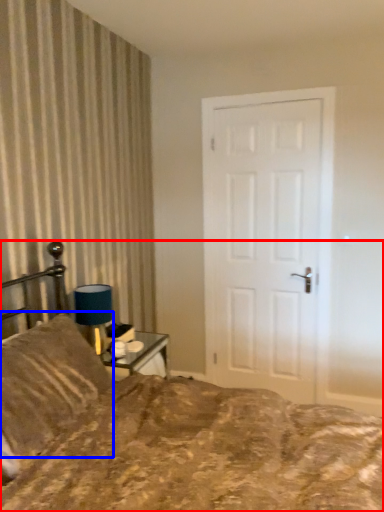
Question: Among these objects, which one is nearest to the camera, bed (highlighted by a red box) or pillow (highlighted by a blue box)?

Choices:
 (A) bed
 (B) pillow

Answer: (A)